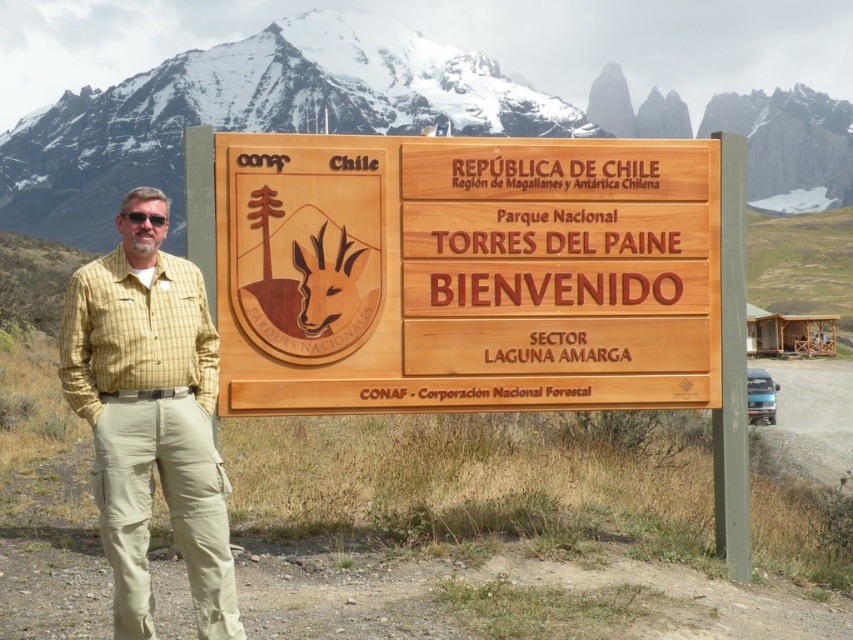
Can you confirm if wooden sign at center is shorter than yellow plaid shirt at left?

Yes, wooden sign at center is shorter than yellow plaid shirt at left.

Does wooden sign at center come in front of yellow plaid shirt at left?

That is False.

Which is behind, point (239, 212) or point (149, 349)?

The point (239, 212) is behind.

Where is `wooden sign at center`? wooden sign at center is located at coordinates (466, 273).

What do you see at coordinates (466, 273) in the screenshot? I see `wooden sign at center` at bounding box center [466, 273].

Does wooden sign at center appear under snowy white mountain at upper center?

Correct, wooden sign at center is located below snowy white mountain at upper center.

Locate an element on the screen. This screenshot has height=640, width=853. wooden sign at center is located at coordinates click(x=466, y=273).

Where is `wooden sign at center`? This screenshot has height=640, width=853. wooden sign at center is located at coordinates (466, 273).

Is snowy white mountain at upper center below yellow plaid shirt at left?

Incorrect, snowy white mountain at upper center is not positioned below yellow plaid shirt at left.

Who is more forward, (169, 61) or (201, 490)?

Point (201, 490) is more forward.

Identify the location of snowy white mountain at upper center. This screenshot has height=640, width=853. (283, 113).